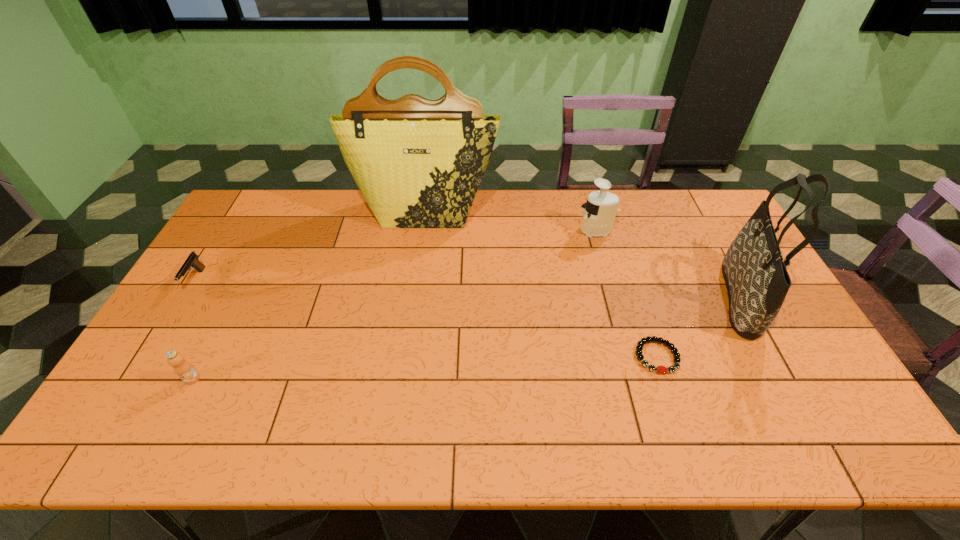
The height and width of the screenshot is (540, 960). What are the coordinates of `vacant space located 0.290m on the front-facing side of the third object from left to right` in the screenshot? It's located at (414, 291).

Locate an element on the screen. This screenshot has height=540, width=960. free space located 0.180m on the back of the right tote bag is located at coordinates (700, 223).

Where is `vacant space situated 0.170m on the right of the juicer`? vacant space situated 0.170m on the right of the juicer is located at coordinates (663, 230).

Locate an element on the screen. vacant area situated 0.120m on the front label of the second object from left to right is located at coordinates (165, 431).

Locate an element on the screen. The height and width of the screenshot is (540, 960). vacant point located at the muzzle of the fifth tallest object is located at coordinates (140, 370).

The height and width of the screenshot is (540, 960). I want to click on vacant region located 0.190m on the back of the shortest object, so click(635, 288).

Where is `tote bag that is at the far edge`? tote bag that is at the far edge is located at coordinates (418, 163).

Locate an element on the screen. The height and width of the screenshot is (540, 960). juicer present at the far edge is located at coordinates (600, 209).

In order to click on orange juice located in the left edge section of the desktop in this screenshot , I will do `click(182, 368)`.

Identify the location of pistol that is at the left edge. (192, 261).